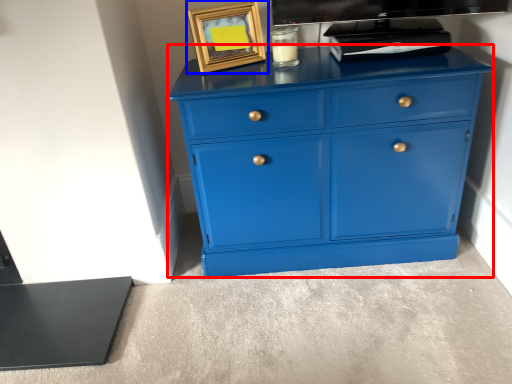
Question: Which object is closer to the camera taking this photo, chest of drawers (highlighted by a red box) or picture frame (highlighted by a blue box)?

Choices:
 (A) chest of drawers
 (B) picture frame

Answer: (A)